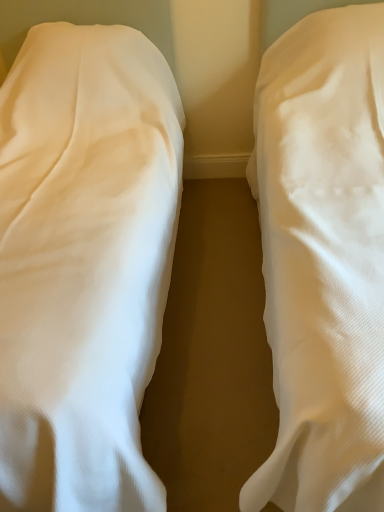
Where is `white fabric bed at left, acting as the 1th bed starting from the left`? The height and width of the screenshot is (512, 384). white fabric bed at left, acting as the 1th bed starting from the left is located at coordinates (84, 263).

Image resolution: width=384 pixels, height=512 pixels. Describe the element at coordinates (84, 263) in the screenshot. I see `white fabric bed at left, acting as the 1th bed starting from the left` at that location.

Locate an element on the screen. The height and width of the screenshot is (512, 384). white textured fabric at center, the second bed from the left is located at coordinates (323, 259).

In order to face white textured fabric at center, which appears as the first bed when viewed from the right, should I rotate leftwards or rightwards?

Turn right by 22.864 degrees to look at white textured fabric at center, which appears as the first bed when viewed from the right.

Describe the element at coordinates (323, 259) in the screenshot. I see `white textured fabric at center, the second bed from the left` at that location.

You are a GUI agent. You are given a task and a screenshot of the screen. Output one action in this format:
    pyautogui.click(x=<x>, y=<y>)
    Task: Click on the white fabric bed at left, acting as the 1th bed starting from the left
    The height and width of the screenshot is (512, 384).
    Given the screenshot: What is the action you would take?
    pyautogui.click(x=84, y=263)

Which object is positioned more to the right, white textured fabric at center, the second bed from the left, or white fabric bed at left, acting as the 1th bed starting from the left?

white textured fabric at center, the second bed from the left, is more to the right.

Is white textured fabric at center, the second bed from the left, further to the viewer compared to white fabric bed at left, which appears as the second bed when viewed from the right?

That is False.

Which is nearer, [368,161] or [23,153]?

Point [368,161]

From the image's perspective, is white textured fabric at center, the second bed from the left, beneath white fabric bed at left, acting as the 1th bed starting from the left?

No.

From a real-world perspective, is white textured fabric at center, the second bed from the left, located higher than white fabric bed at left, which appears as the second bed when viewed from the right?

No.

Which object is thinner, white textured fabric at center, the second bed from the left, or white fabric bed at left, acting as the 1th bed starting from the left?

Thinner between the two is white textured fabric at center, the second bed from the left.

Consider the image. Is white textured fabric at center, the second bed from the left, shorter than white fabric bed at left, which appears as the second bed when viewed from the right?

Yes.

In the scene shown: Between white textured fabric at center, the second bed from the left, and white fabric bed at left, which appears as the second bed when viewed from the right, which one has smaller size?

With smaller size is white textured fabric at center, the second bed from the left.

From the picture: Would you say white fabric bed at left, acting as the 1th bed starting from the left, is part of white textured fabric at center, the second bed from the left,'s contents?

Actually, white fabric bed at left, acting as the 1th bed starting from the left, is outside white textured fabric at center, the second bed from the left.

Consider the image. Is white textured fabric at center, which appears as the first bed when viewed from the right, positioned far away from white fabric bed at left, acting as the 1th bed starting from the left?

They are positioned close to each other.

Could you tell me if white textured fabric at center, which appears as the first bed when viewed from the right, is turned towards white fabric bed at left, which appears as the second bed when viewed from the right?

No, white textured fabric at center, which appears as the first bed when viewed from the right, is not oriented towards white fabric bed at left, which appears as the second bed when viewed from the right.

What's the angular difference between white textured fabric at center, the second bed from the left, and white fabric bed at left, acting as the 1th bed starting from the left,'s facing directions?

There is a 1.23e-05-degree angle between the facing directions of white textured fabric at center, the second bed from the left, and white fabric bed at left, acting as the 1th bed starting from the left.

Locate an element on the screen. bed that is above the white textured fabric at center, which appears as the first bed when viewed from the right (from a real-world perspective) is located at coordinates (84, 263).

Based on the photo, would you say white fabric bed at left, acting as the 1th bed starting from the left, is to the left or to the right of white textured fabric at center, the second bed from the left, in the picture?

white fabric bed at left, acting as the 1th bed starting from the left, is to the left of white textured fabric at center, the second bed from the left.

Relative to white textured fabric at center, the second bed from the left, is white fabric bed at left, which appears as the second bed when viewed from the right, in front or behind?

white fabric bed at left, which appears as the second bed when viewed from the right, is positioned farther from the viewer than white textured fabric at center, the second bed from the left.

Considering the positions of point (174, 218) and point (308, 350), is point (174, 218) closer or farther from the camera than point (308, 350)?

Point (174, 218).

From the image's perspective, is white fabric bed at left, acting as the 1th bed starting from the left, positioned above or below white textured fabric at center, which appears as the first bed when viewed from the right?

Based on their image positions, white fabric bed at left, acting as the 1th bed starting from the left, is located beneath white textured fabric at center, which appears as the first bed when viewed from the right.

From a real-world perspective, relative to white textured fabric at center, the second bed from the left, is white fabric bed at left, which appears as the second bed when viewed from the right, vertically above or below?

Clearly, from a real-world perspective, white fabric bed at left, which appears as the second bed when viewed from the right, is above white textured fabric at center, the second bed from the left.

Between white fabric bed at left, which appears as the second bed when viewed from the right, and white textured fabric at center, the second bed from the left, which one has smaller width?

white textured fabric at center, the second bed from the left.

Is white fabric bed at left, acting as the 1th bed starting from the left, taller or shorter than white textured fabric at center, which appears as the first bed when viewed from the right?

Clearly, white fabric bed at left, acting as the 1th bed starting from the left, is taller compared to white textured fabric at center, which appears as the first bed when viewed from the right.

Can you confirm if white fabric bed at left, acting as the 1th bed starting from the left, is smaller than white textured fabric at center, the second bed from the left?

No, white fabric bed at left, acting as the 1th bed starting from the left, is not smaller than white textured fabric at center, the second bed from the left.

Is white fabric bed at left, acting as the 1th bed starting from the left, spatially inside white textured fabric at center, the second bed from the left, or outside of it?

white fabric bed at left, acting as the 1th bed starting from the left, is outside white textured fabric at center, the second bed from the left.

Is white fabric bed at left, acting as the 1th bed starting from the left, touching white textured fabric at center, the second bed from the left?

No.

Is white fabric bed at left, which appears as the second bed when viewed from the right, aimed at white textured fabric at center, which appears as the first bed when viewed from the right?

No.

What's the angular difference between white fabric bed at left, acting as the 1th bed starting from the left, and white textured fabric at center, the second bed from the left,'s facing directions?

1.23e-05 degrees separate the facing orientations of white fabric bed at left, acting as the 1th bed starting from the left, and white textured fabric at center, the second bed from the left.

Measure the distance between white fabric bed at left, which appears as the second bed when viewed from the right, and white textured fabric at center, which appears as the first bed when viewed from the right.

The distance of white fabric bed at left, which appears as the second bed when viewed from the right, from white textured fabric at center, which appears as the first bed when viewed from the right, is 24.50 inches.

Locate an element on the screen. This screenshot has width=384, height=512. bed that appears in front of the white fabric bed at left, which appears as the second bed when viewed from the right is located at coordinates (323, 259).

Locate an element on the screen. Image resolution: width=384 pixels, height=512 pixels. bed in front of the white fabric bed at left, which appears as the second bed when viewed from the right is located at coordinates (323, 259).

I want to click on bed that appears above the white textured fabric at center, the second bed from the left (from a real-world perspective), so click(84, 263).